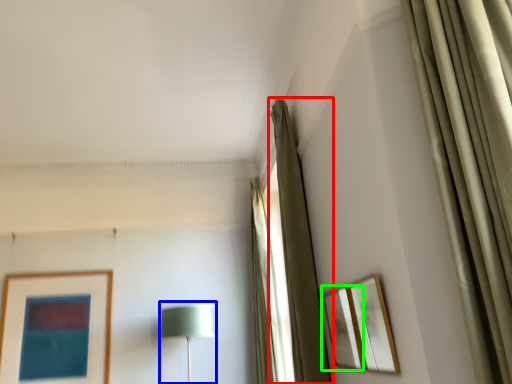
Question: Considering the real-world distances, which object is farthest from curtain (highlighted by a red box)? table lamp (highlighted by a blue box) or picture frame (highlighted by a green box)?

Choices:
 (A) table lamp
 (B) picture frame

Answer: (A)